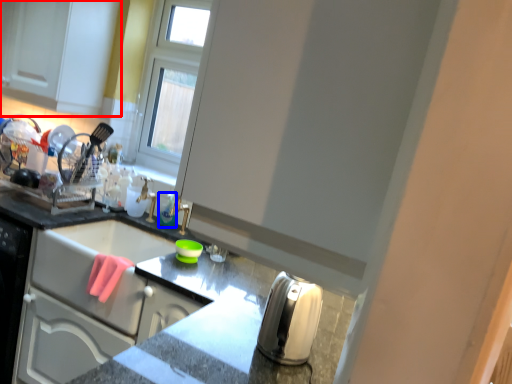
Question: Which point is closer to the camera, cabinetry (highlighted by a red box) or bottle (highlighted by a blue box)?

Choices:
 (A) cabinetry
 (B) bottle

Answer: (A)